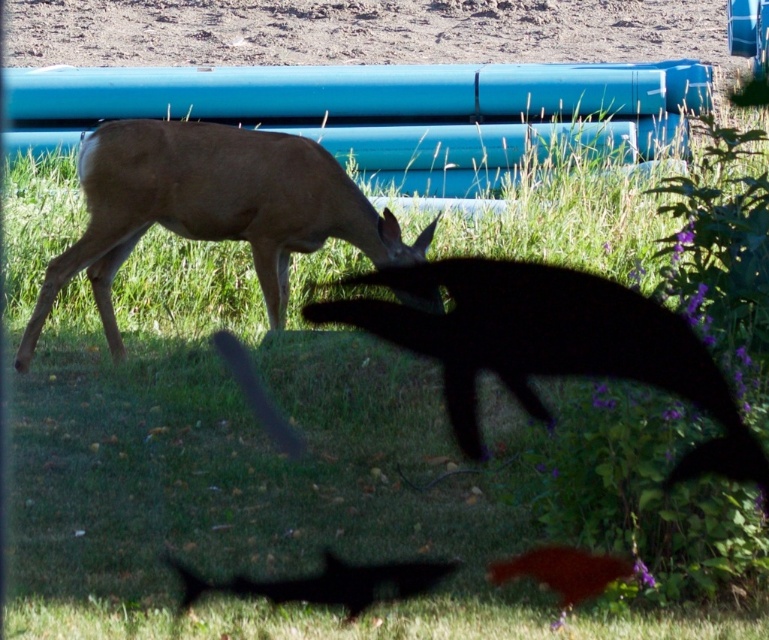
You are standing in the outdoor scene and want to walk from the point at coordinates point (x=651, y=349) to the point at coordinates point (x=258, y=588). Which direction should you head to reach your destination?

You should head away from the viewer because point (x=651, y=349) is further to the viewer than point (x=258, y=588).

You are observing a deer scene. There is a brown matte deer at center and a black matte deer at lower center. Which deer is positioned higher in the image?

The brown matte deer at center is positioned higher than the black matte deer at lower center in the image.